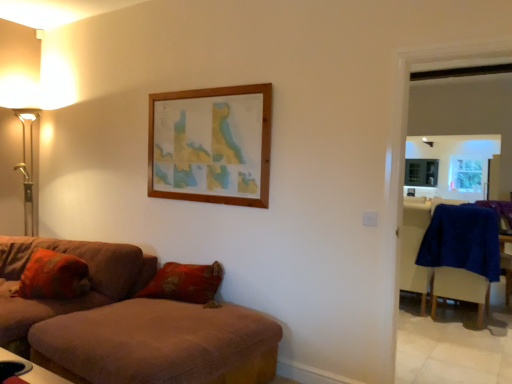
Question: Considering the relative positions of textured orange pillow at lower left and brown fabric ottoman at lower left, placed as the first studio couch when sorted from right to left, in the image provided, is textured orange pillow at lower left to the left or to the right of brown fabric ottoman at lower left, placed as the first studio couch when sorted from right to left,?

Choices:
 (A) right
 (B) left

Answer: (B)

Question: From a real-world perspective, is textured orange pillow at lower left physically located above or below brown fabric ottoman at lower left, placed as the first studio couch when sorted from right to left?

Choices:
 (A) below
 (B) above

Answer: (B)

Question: Considering the real-world distances, which object is farthest from the blue fabric armchair at right?

Choices:
 (A) blue fuzzy swivel chair at right
 (B) brown fabric ottoman at lower left, placed as the first studio couch when sorted from right to left
 (C) gold metallic floor lamp at left
 (D) brown fabric couch at lower left, arranged as the 2th studio couch when viewed from the right
 (E) textured orange pillow at lower left

Answer: (C)

Question: Estimate the real-world distances between objects in this image. Which object is closer to the brown fabric couch at lower left, arranged as the 2th studio couch when viewed from the right?

Choices:
 (A) brown fabric ottoman at lower left, the 2th studio couch when ordered from left to right
 (B) blue fuzzy swivel chair at right
 (C) blue fabric armchair at right
 (D) textured orange pillow at lower left
 (E) gold metallic floor lamp at left

Answer: (D)